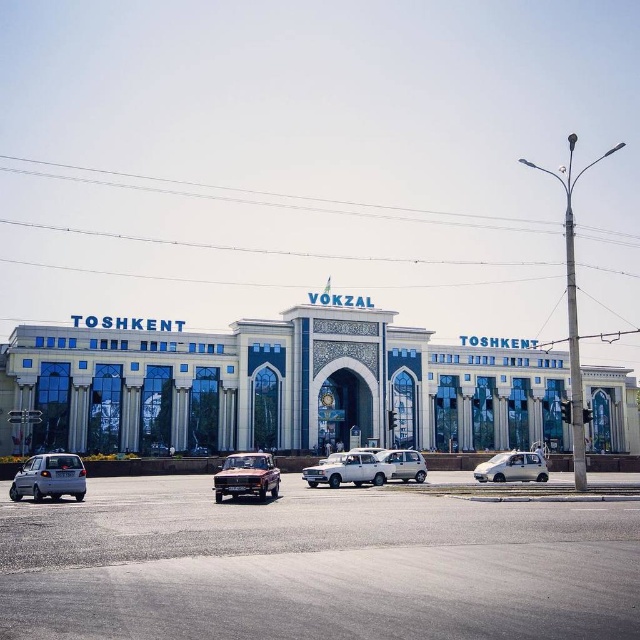
You are a photographer planning to capture the Toshkent Vokzal building with both the silver metallic car at center and the satin silver sedan at center in the frame. Since you want to emphasize the smaller vehicle, which car should you position closer to the camera?

To emphasize the smaller satin silver sedan at center, you should position it closer to the camera since it is smaller than the silver metallic car at center.

You are standing in front of the Toshkent Vokzal and want to take a photo of both the white glass building at center and the rustic metallic car at center. Which object should you focus on first to ensure both are in frame?

You should focus on the white glass building at center first because it is closer to you than the rustic metallic car at center, so by focusing on it, the car will also be in the frame as it is further away.